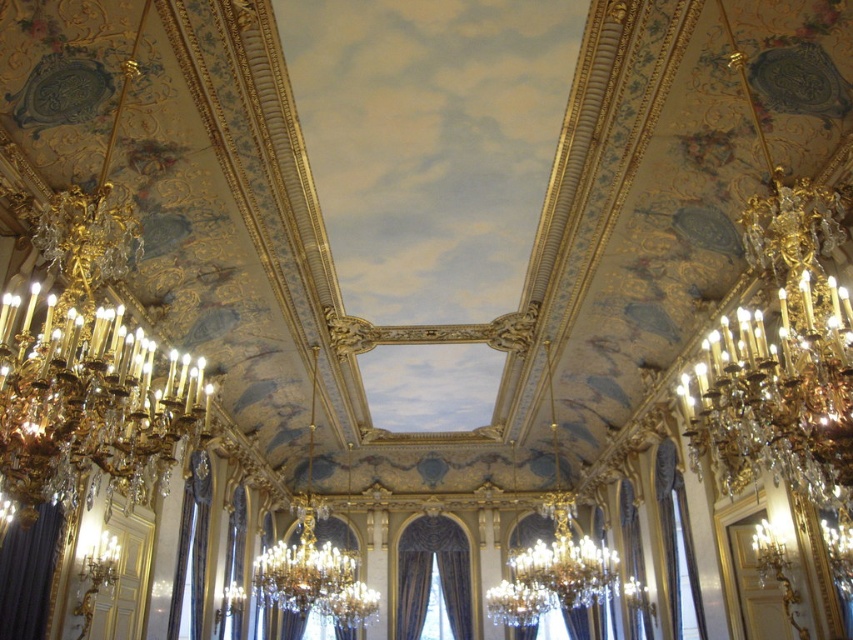
Looking at this image, you are a guest at a formal event in this grand hall. You notice the velvet drapery at center and the dark blue velvet curtain at lower left. Which one is positioned lower in the room?

The velvet drapery at center is positioned lower in the room than the dark blue velvet curtain at lower left.

You are standing in the grand hall and want to locate the velvet drapery at center and the dark blue velvet curtain at lower left. Which one is positioned to the right of the other?

The velvet drapery at center is positioned to the right of the dark blue velvet curtain at lower left.